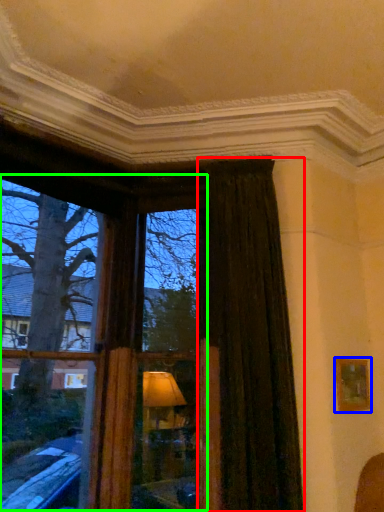
Question: Estimate the real-world distances between objects in this image. Which object is closer to curtain (highlighted by a red box), picture frame (highlighted by a blue box) or bay window (highlighted by a green box)?

Choices:
 (A) picture frame
 (B) bay window

Answer: (A)